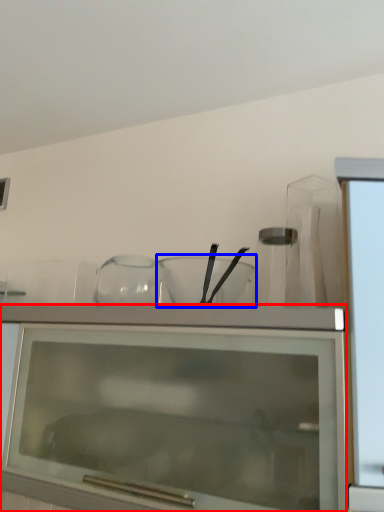
Question: Among these objects, which one is nearest to the camera, cabinetry (highlighted by a red box) or mixing bowl (highlighted by a blue box)?

Choices:
 (A) cabinetry
 (B) mixing bowl

Answer: (A)